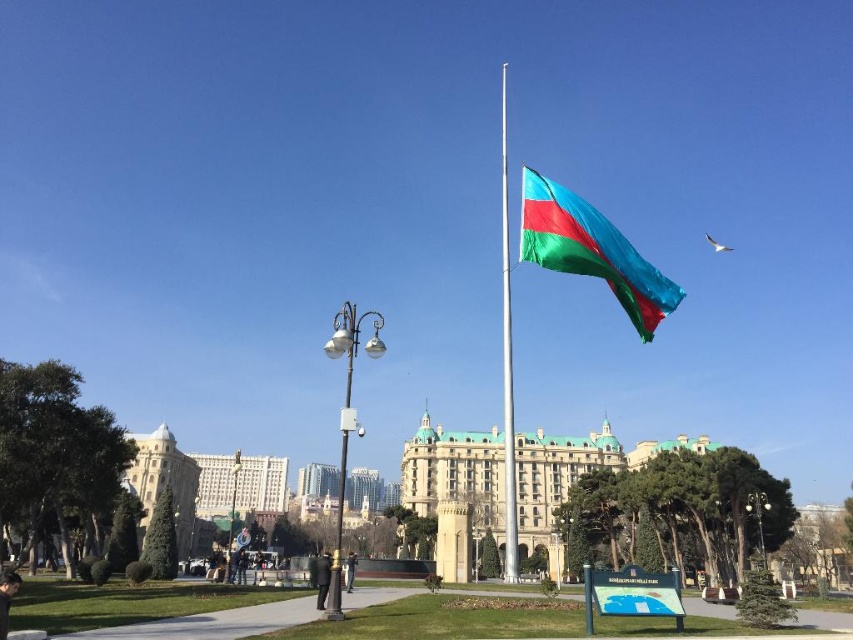
Who is taller, beige stone palace at center or polished brass streetlight at center-left?

Standing taller between the two is polished brass streetlight at center-left.

Which is in front, point (418, 504) or point (332, 554)?

Point (418, 504) is more forward.

Where is `beige stone palace at center`? The image size is (853, 640). beige stone palace at center is located at coordinates (572, 476).

Can you confirm if textured fabric flag at center is shorter than polished metal streetlight at center?

No, textured fabric flag at center is not shorter than polished metal streetlight at center.

What do you see at coordinates (590, 250) in the screenshot? I see `textured fabric flag at center` at bounding box center [590, 250].

Is point (537, 237) positioned before point (746, 506)?

Yes, it is in front of point (746, 506).

The height and width of the screenshot is (640, 853). In order to click on textured fabric flag at center in this screenshot , I will do `click(590, 250)`.

Is beige stone palace at center thinner than polished silver flag pole at center?

In fact, beige stone palace at center might be wider than polished silver flag pole at center.

Who is higher up, beige stone palace at center or polished silver flag pole at center?

polished silver flag pole at center

Where is `beige stone palace at center`? The image size is (853, 640). beige stone palace at center is located at coordinates (572, 476).